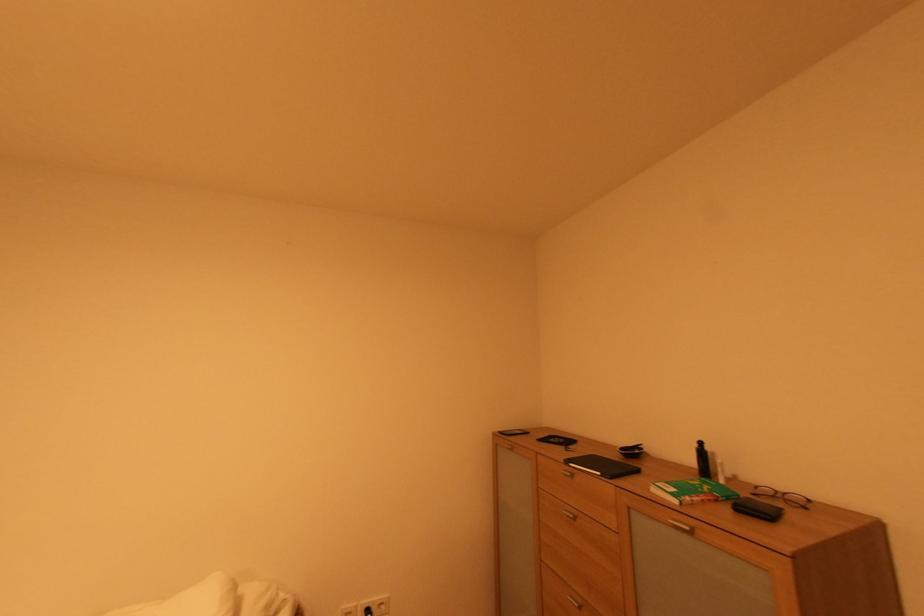
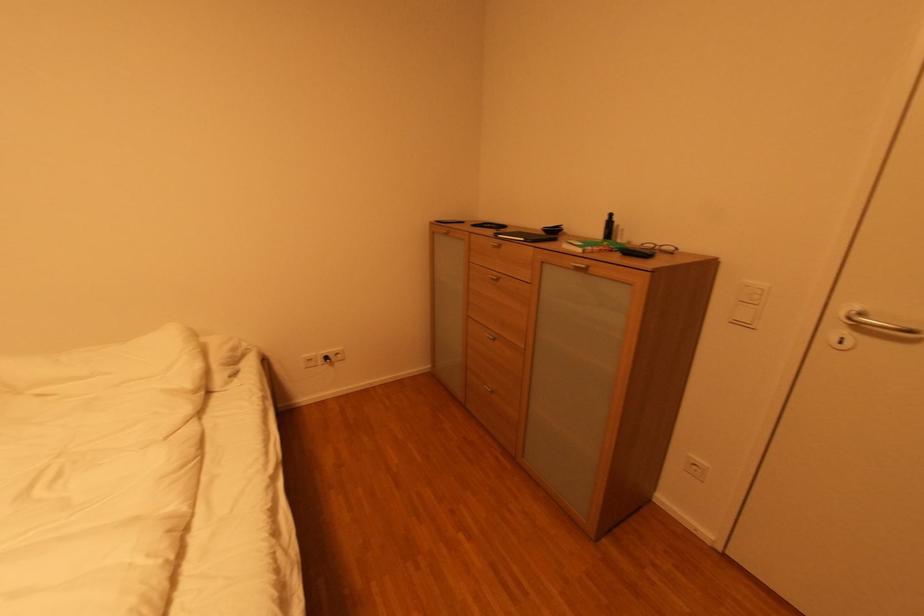
Question: The first image is from the beginning of the video and the second image is from the end. How did the camera likely rotate when shooting the video?

Choices:
 (A) Left
 (B) Right
 (C) Up
 (D) Down

Answer: (D)